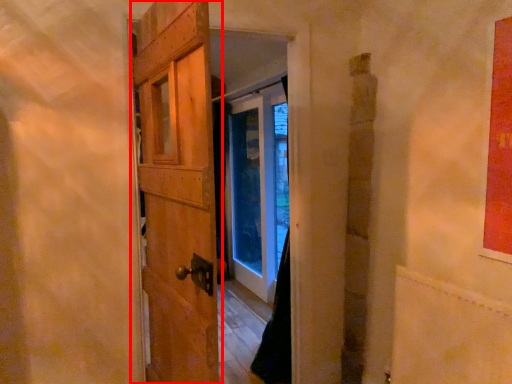
Question: From the image's perspective, considering the relative positions of door (annotated by the red box) and plywood in the image provided, where is door (annotated by the red box) located with respect to the staircase?

Choices:
 (A) above
 (B) below

Answer: (A)